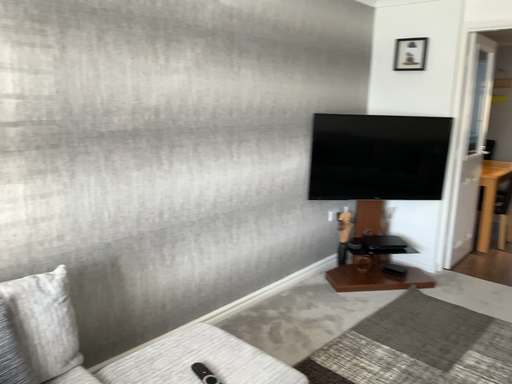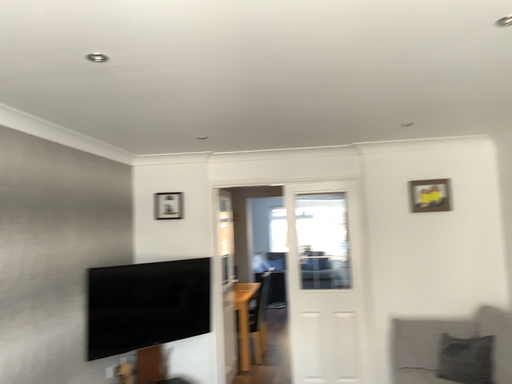
Question: How did the camera likely rotate when shooting the video?

Choices:
 (A) rotated downward
 (B) rotated upward

Answer: (B)